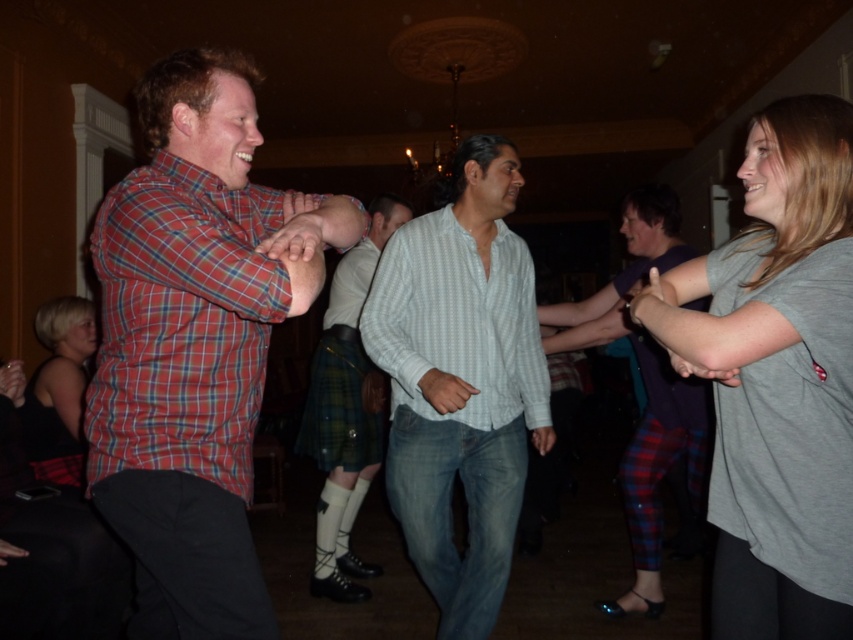
You are standing in the room and want to see the green plaid kilt at center without moving your head. Can you see it behind the plaid shirt at left?

The plaid shirt at left is in front of the green plaid kilt at center, so yes, you can see the green plaid kilt at center behind the plaid shirt at left as long as there is enough space between them for visibility.

You are a photographer at this event and want to take a picture of the green plaid kilt at center and the matte black tank top at lower left. Which of these two items should you focus on first if you want to capture both in a single frame without moving the camera?

The green plaid kilt at center is bigger than the matte black tank top at lower left, so you should focus on the green plaid kilt at center first to ensure it fills the frame appropriately before adjusting for the smaller matte black tank top at lower left.